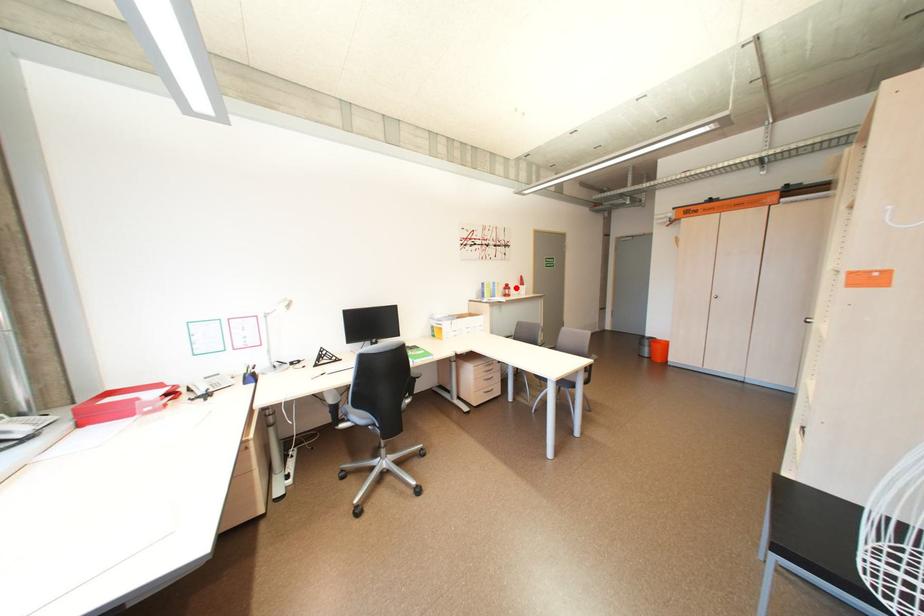
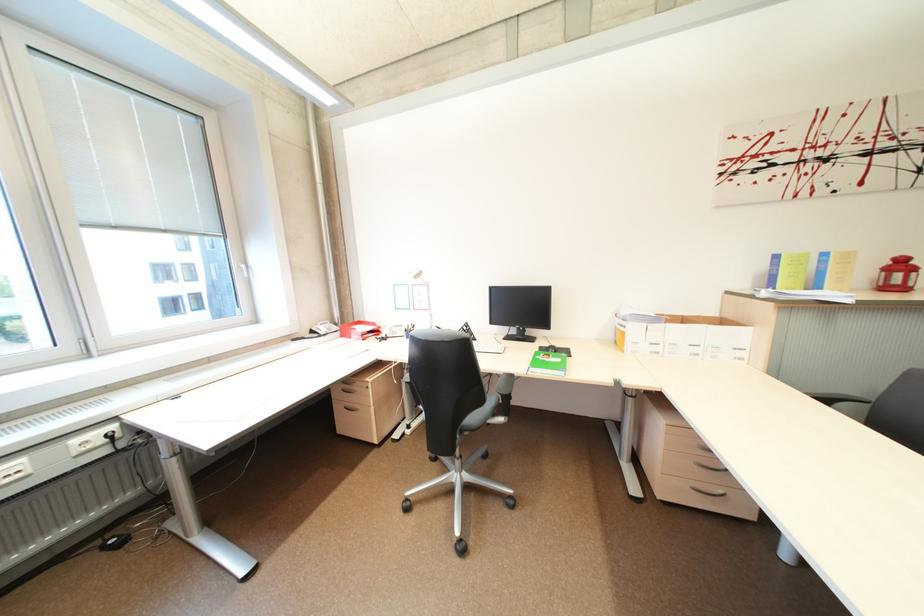
Question: A red point is marked in image1. In image2, is the corresponding 3D point closer to the camera or farther? Reply with the corresponding letter.

Choices:
 (A) The corresponding 3D point is closer.
 (B) The corresponding 3D point is farther.

Answer: (B)